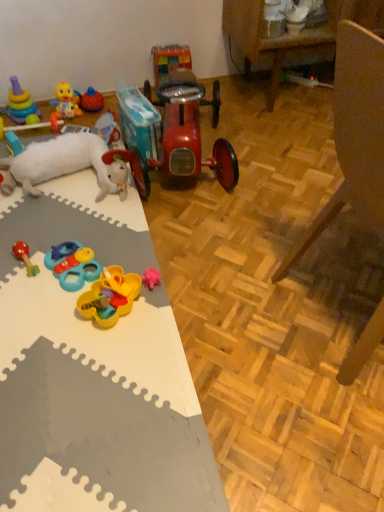
Image resolution: width=384 pixels, height=512 pixels. Find the location of `yellow rubber duck at upper left, the 9th toy viewed from the right`. yellow rubber duck at upper left, the 9th toy viewed from the right is located at coordinates (66, 102).

Where is `plastic/soft yellow and blue toy at lower left, the 4th toy viewed from the right`? plastic/soft yellow and blue toy at lower left, the 4th toy viewed from the right is located at coordinates (72, 265).

Find the location of `shiny red car at center, which is the first toy in right-to-left order`. shiny red car at center, which is the first toy in right-to-left order is located at coordinates (185, 138).

Considering their positions, is wooden armchair at lower right located in front of or behind yellow plastic toy at center, positioned as the 9th toy in left-to-right order?

In the image, wooden armchair at lower right appears in front of yellow plastic toy at center, positioned as the 9th toy in left-to-right order.

How many degrees apart are the facing directions of wooden armchair at lower right and yellow plastic toy at center, positioned as the 9th toy in left-to-right order?

There is a 137-degree angle between the facing directions of wooden armchair at lower right and yellow plastic toy at center, positioned as the 9th toy in left-to-right order.

From the image's perspective, would you say wooden armchair at lower right is shown under yellow plastic toy at center, positioned as the 9th toy in left-to-right order?

Actually, wooden armchair at lower right appears above yellow plastic toy at center, positioned as the 9th toy in left-to-right order, in the image.

Is wooden armchair at lower right to the left or to the right of yellow plastic toy at center, positioned as the 9th toy in left-to-right order, in the image?

Clearly, wooden armchair at lower right is on the right of yellow plastic toy at center, positioned as the 9th toy in left-to-right order, in the image.

Find the location of a particular element. This screenshot has height=512, width=384. the 8th toy to the left of the shiny red car at center, which is the first toy in right-to-left order, starting your count from the anchor is located at coordinates (66, 102).

In the scene shown: Considering the relative sizes of shiny red car at center, which ranks as the 11th toy in left-to-right order, and yellow rubber duck at upper left, the third toy in the left-to-right sequence, in the image provided, is shiny red car at center, which ranks as the 11th toy in left-to-right order, smaller than yellow rubber duck at upper left, the third toy in the left-to-right sequence,?

Actually, shiny red car at center, which ranks as the 11th toy in left-to-right order, might be larger than yellow rubber duck at upper left, the third toy in the left-to-right sequence.

What's the angular difference between shiny red car at center, which ranks as the 11th toy in left-to-right order, and yellow rubber duck at upper left, the 9th toy viewed from the right,'s facing directions?

There is a 11.2-degree angle between the facing directions of shiny red car at center, which ranks as the 11th toy in left-to-right order, and yellow rubber duck at upper left, the 9th toy viewed from the right.

From the picture: Is shiny red car at center, which ranks as the 11th toy in left-to-right order, to the right of yellow rubber duck at upper left, the third toy in the left-to-right sequence, from the viewer's perspective?

Indeed, shiny red car at center, which ranks as the 11th toy in left-to-right order, is positioned on the right side of yellow rubber duck at upper left, the third toy in the left-to-right sequence.

Is wooden armchair at lower right with shiny red car at center, which ranks as the 11th toy in left-to-right order?

No, wooden armchair at lower right is not with shiny red car at center, which ranks as the 11th toy in left-to-right order.

Is wooden armchair at lower right outside of shiny red car at center, which ranks as the 11th toy in left-to-right order?

Yes.

Who is more distant, wooden armchair at lower right or shiny red car at center, which is the first toy in right-to-left order?

shiny red car at center, which is the first toy in right-to-left order, is more distant.

Considering the relative sizes of wooden armchair at lower right and shiny red car at center, which ranks as the 11th toy in left-to-right order, in the image provided, is wooden armchair at lower right wider than shiny red car at center, which ranks as the 11th toy in left-to-right order,?

In fact, wooden armchair at lower right might be narrower than shiny red car at center, which ranks as the 11th toy in left-to-right order.

Is white foam mat at left in contact with rubber duck at left, arranged as the second toy when viewed from the left?

white foam mat at left and rubber duck at left, arranged as the second toy when viewed from the left, are clearly separated.

Which object is positioned more to the left, white foam mat at left or rubber duck at left, arranged as the second toy when viewed from the left?

From the viewer's perspective, rubber duck at left, arranged as the second toy when viewed from the left, appears more on the left side.

Could you tell me if white foam mat at left is facing rubber duck at left, marked as the tenth toy in a right-to-left arrangement?

No, white foam mat at left does not turn towards rubber duck at left, marked as the tenth toy in a right-to-left arrangement.

Is point (1, 482) behind point (7, 136)?

That is False.

Identify the location of the 11th toy located above the white foam mat at left (from a real-world perspective). The height and width of the screenshot is (512, 384). (185, 138).

Which of these two, shiny red car at center, which is the first toy in right-to-left order, or white foam mat at left, is smaller?

With smaller size is white foam mat at left.

From their relative heights in the image, would you say shiny red car at center, which is the first toy in right-to-left order, is taller or shorter than white foam mat at left?

Considering their sizes, shiny red car at center, which is the first toy in right-to-left order, has more height than white foam mat at left.

From a real-world perspective, between shiny red car at center, which ranks as the 11th toy in left-to-right order, and white foam mat at left, who is vertically lower?

white foam mat at left.

Is yellow rubber duck at upper left, the 9th toy viewed from the right, closer to the viewer compared to stacked plastic rings at upper left, the eleventh toy from the right?

No, yellow rubber duck at upper left, the 9th toy viewed from the right, is further to the viewer.

Is yellow rubber duck at upper left, the 9th toy viewed from the right, surrounding stacked plastic rings at upper left, the first toy when ordered from left to right?

No, stacked plastic rings at upper left, the first toy when ordered from left to right, is located outside of yellow rubber duck at upper left, the 9th toy viewed from the right.

Considering the points (79, 113) and (16, 112), which point is in front, point (79, 113) or point (16, 112)?

Point (16, 112)

How many degrees apart are the facing directions of yellow rubber duck at upper left, the third toy in the left-to-right sequence, and stacked plastic rings at upper left, the eleventh toy from the right?

The angle between the facing direction of yellow rubber duck at upper left, the third toy in the left-to-right sequence, and the facing direction of stacked plastic rings at upper left, the eleventh toy from the right, is 1.92 degrees.

Between rubber duck at left, arranged as the second toy when viewed from the left, and yellow rubber duck at upper left, the 9th toy viewed from the right, which one has smaller size?

With smaller size is rubber duck at left, arranged as the second toy when viewed from the left.

Who is taller, rubber duck at left, arranged as the second toy when viewed from the left, or yellow rubber duck at upper left, the 9th toy viewed from the right?

Standing taller between the two is yellow rubber duck at upper left, the 9th toy viewed from the right.

Are rubber duck at left, marked as the tenth toy in a right-to-left arrangement, and yellow rubber duck at upper left, the third toy in the left-to-right sequence, located far from each other?

No, there isn't a large distance between rubber duck at left, marked as the tenth toy in a right-to-left arrangement, and yellow rubber duck at upper left, the third toy in the left-to-right sequence.

Where is `the 3rd toy to the left of the wooden armchair at lower right, starting your count from the anchor`? This screenshot has width=384, height=512. the 3rd toy to the left of the wooden armchair at lower right, starting your count from the anchor is located at coordinates (110, 295).

There is a shiny red car at center, which ranks as the 11th toy in left-to-right order. Where is `the 3rd toy below it (from a real-world perspective)`? the 3rd toy below it (from a real-world perspective) is located at coordinates (66, 102).

Based on their spatial positions, is rubber duck at upper left, which is the sixth toy from right to left, or white foam mat at left further from yellow plastic toy at center, positioned as the 9th toy in left-to-right order?

rubber duck at upper left, which is the sixth toy from right to left, lies further to yellow plastic toy at center, positioned as the 9th toy in left-to-right order, than the other object.

Based on their spatial positions, is white foam mat at left or yellow plastic toy at center, arranged as the 3th toy when viewed from the right, closer to multicolored plastic toy at center, which is the 2th toy from right to left?

yellow plastic toy at center, arranged as the 3th toy when viewed from the right.

Which object lies further to the anchor point shiny red car at center, which ranks as the 11th toy in left-to-right order, white plush sheep at left, which appears as the 5th toy when viewed from the left, or rubber duck at left, arranged as the second toy when viewed from the left?

rubber duck at left, arranged as the second toy when viewed from the left, lies further to shiny red car at center, which ranks as the 11th toy in left-to-right order, than the other object.

Estimate the real-world distances between objects in this image. Which object is closer to wooden armchair at lower right, shiny red car at center, which is the first toy in right-to-left order, or rubber duck at upper left, the sixth toy viewed from the left?

shiny red car at center, which is the first toy in right-to-left order, is positioned closer to the anchor wooden armchair at lower right.

When comparing their distances from rubber duck at left, arranged as the second toy when viewed from the left, does yellow plastic toy at center, arranged as the 3th toy when viewed from the right, or yellow rubber duck at upper left, the 9th toy viewed from the right, seem closer?

yellow rubber duck at upper left, the 9th toy viewed from the right, is positioned closer to the anchor rubber duck at left, arranged as the second toy when viewed from the left.

When comparing their distances from yellow plastic toy at center, positioned as the 9th toy in left-to-right order, does white plush sheep at left, which appears as the 5th toy when viewed from the left, or rubber duck at upper left, which is the sixth toy from right to left, seem closer?

Based on the image, white plush sheep at left, which appears as the 5th toy when viewed from the left, appears to be nearer to yellow plastic toy at center, positioned as the 9th toy in left-to-right order.

Considering their positions, is stacked plastic rings at upper left, the first toy when ordered from left to right, positioned further to rubber duck at left, arranged as the second toy when viewed from the left, than yellow rubber duck at upper left, the third toy in the left-to-right sequence?

yellow rubber duck at upper left, the third toy in the left-to-right sequence.

Considering their positions, is plastic/soft yellow and blue toy at lower left, the 4th toy viewed from the right, positioned further to multicolored plastic toy at center, which is the 2th toy from right to left, than rubber duck at upper left, which is the sixth toy from right to left?

plastic/soft yellow and blue toy at lower left, the 4th toy viewed from the right, is further to multicolored plastic toy at center, which is the 2th toy from right to left.

Identify the location of table located between rubber duck at left, marked as the tenth toy in a right-to-left arrangement, and wooden armchair at lower right in the left-right direction. The width and height of the screenshot is (384, 512). (93, 371).

Identify the location of table between wooden armchair at lower right and yellow rubber duck at upper left, the third toy in the left-to-right sequence, from front to back. This screenshot has width=384, height=512. (93, 371).

Identify the location of table positioned between wooden armchair at lower right and rubber duck at center, the seventh toy positioned from the left, from near to far. The image size is (384, 512). (93, 371).

Find the location of `table between white plush sheep at left, which ranks as the 7th toy in right-to-left order, and wooden armchair at lower right from left to right`. table between white plush sheep at left, which ranks as the 7th toy in right-to-left order, and wooden armchair at lower right from left to right is located at coordinates (93, 371).